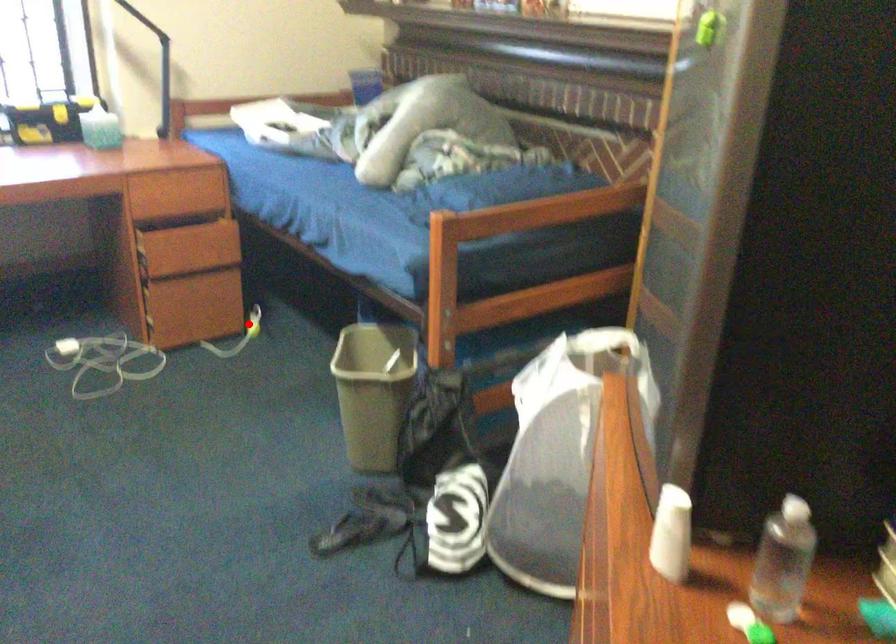
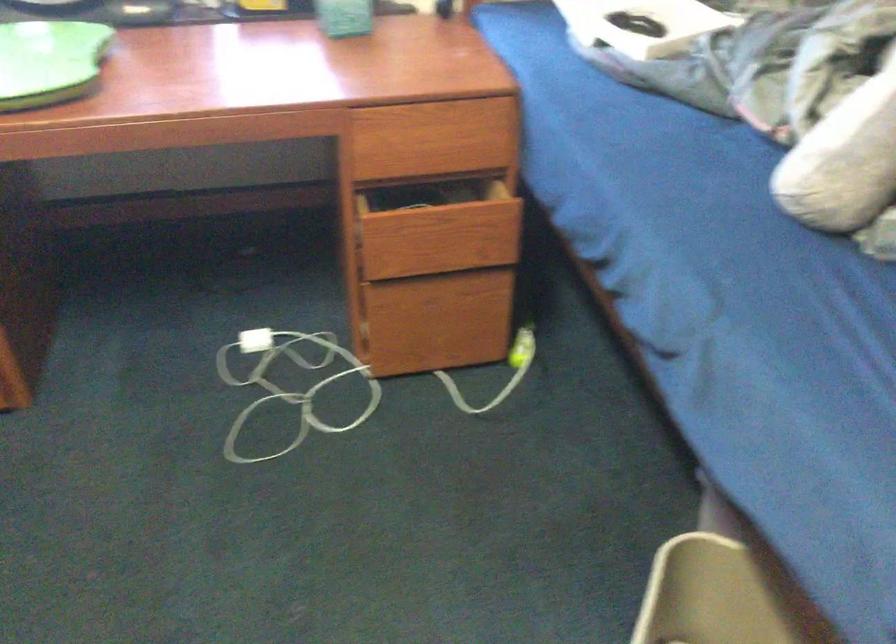
The point at the highlighted location is marked in the first image. Where is the corresponding point in the second image?

(521, 346)